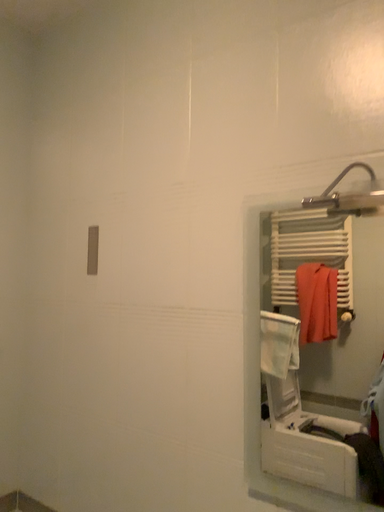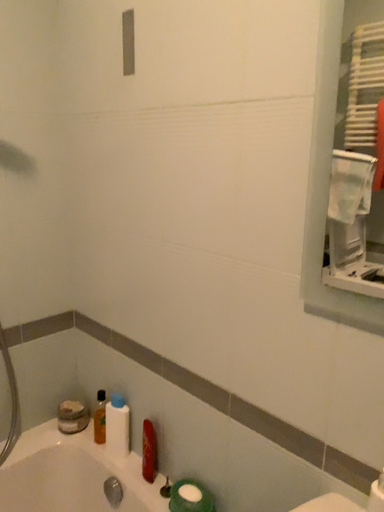
Question: Which way did the camera rotate in the video?

Choices:
 (A) rotated left
 (B) rotated right

Answer: (A)